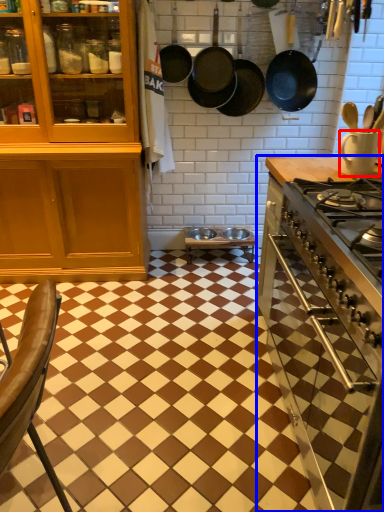
Question: Which point is closer to the camera, kitchen appliance (highlighted by a red box) or countertop (highlighted by a blue box)?

Choices:
 (A) kitchen appliance
 (B) countertop

Answer: (B)